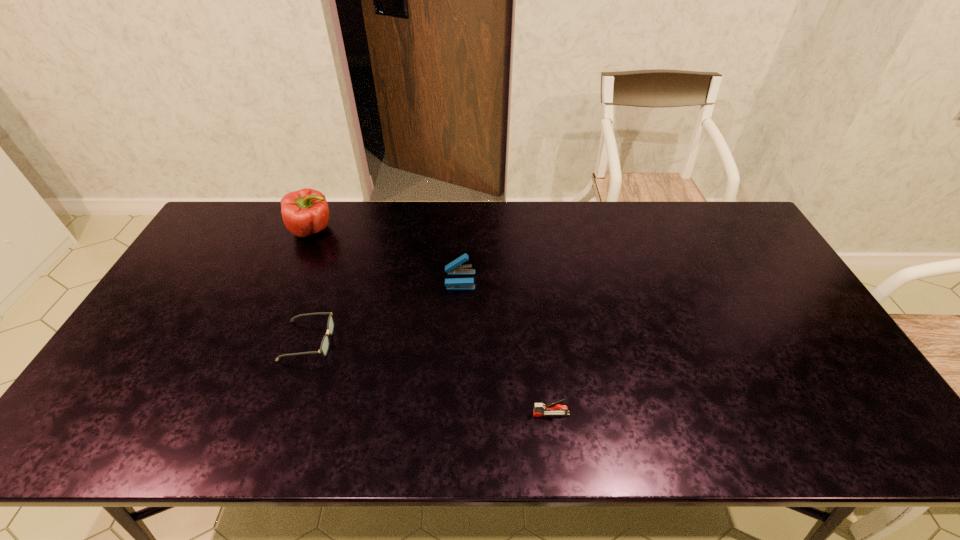
You are a GUI agent. You are given a task and a screenshot of the screen. Output one action in this format:
    pyautogui.click(x=<x>, y=<y>)
    Task: Click on the free space located 0.160m on the handle side of the nearer stapler
    Image resolution: width=960 pixels, height=540 pixels.
    Given the screenshot: What is the action you would take?
    pyautogui.click(x=466, y=414)

At what (x,y) coordinates should I click in order to perform the action: click on blank space located 0.080m on the handle side of the nearer stapler. Please return your answer as a coordinate pair (x, y). The image size is (960, 540). Looking at the image, I should click on (499, 414).

Image resolution: width=960 pixels, height=540 pixels. Identify the location of vacant space situated on the handle side of the nearer stapler. (436, 414).

Locate an element on the screen. Image resolution: width=960 pixels, height=540 pixels. vacant space located on the face of the third farthest object is located at coordinates (392, 341).

Where is `object positioned at the far edge`? The height and width of the screenshot is (540, 960). object positioned at the far edge is located at coordinates (304, 212).

This screenshot has height=540, width=960. Find the location of `object located in the near edge section of the desktop`. object located in the near edge section of the desktop is located at coordinates (550, 409).

Where is `vacant region at the far edge of the desktop`? vacant region at the far edge of the desktop is located at coordinates (475, 201).

The height and width of the screenshot is (540, 960). In the image, there is a desktop. In order to click on vacant area at the near edge in this screenshot , I will do `click(749, 446)`.

What are the coordinates of `vacant area at the left edge of the desktop` in the screenshot? It's located at (182, 300).

The width and height of the screenshot is (960, 540). I want to click on free space at the right edge of the desktop, so click(746, 269).